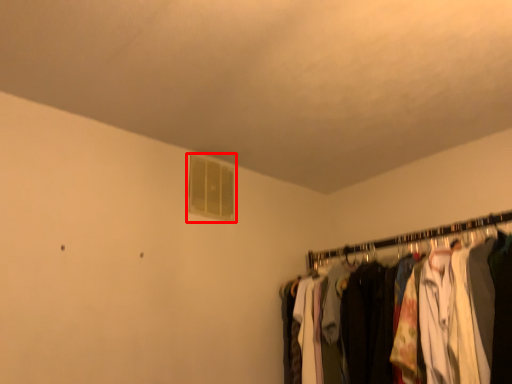
Question: Observing the image, what is the correct spatial positioning of window (annotated by the red box) in reference to closet?

Choices:
 (A) left
 (B) right

Answer: (A)